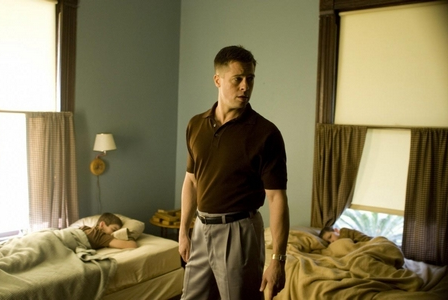
I want to click on lamp, so pyautogui.click(x=104, y=146).